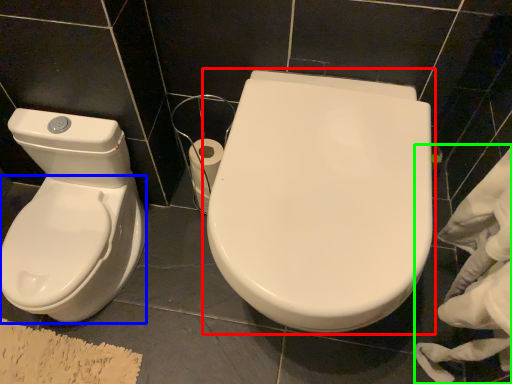
Question: Based on their relative distances, which object is farther from toilet (highlighted by a red box)? Choose from bidet (highlighted by a blue box) and material (highlighted by a green box).

Choices:
 (A) bidet
 (B) material

Answer: (A)